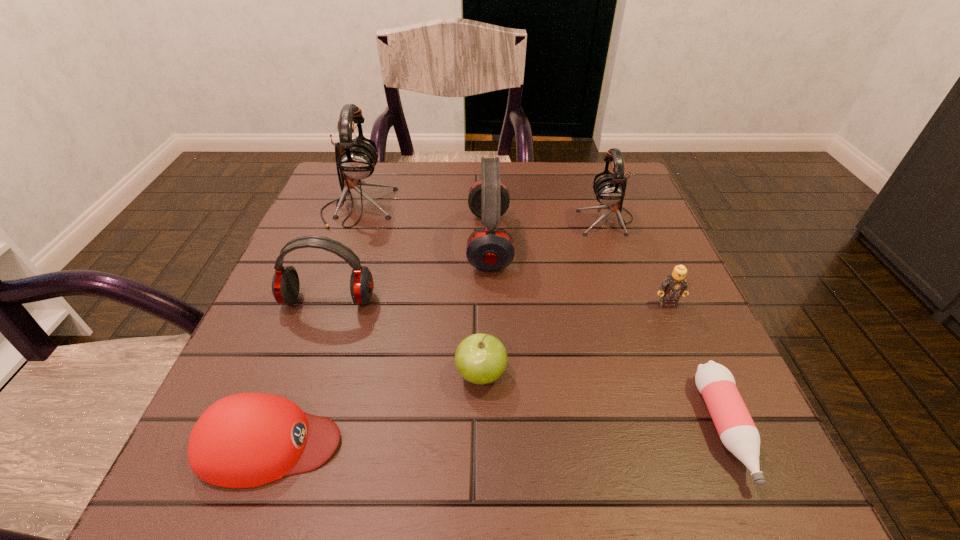
Identify the location of empty location between the tan Lego and the right black earphone. (636, 261).

Locate an element on the screen. free space between the Lego and the bottle is located at coordinates [x=696, y=366].

The width and height of the screenshot is (960, 540). Identify the location of free area in between the bigger black earphone and the green apple. pos(420,291).

The image size is (960, 540). I want to click on free spot between the pink bottle and the baseball cap, so click(x=497, y=436).

Where is `vacant area that lies between the bottle and the baseball cap`? vacant area that lies between the bottle and the baseball cap is located at coordinates (497, 436).

Locate an element on the screen. unoccupied position between the baseball cap and the bottle is located at coordinates (497, 436).

Where is `empty space between the pink bottle and the shortest earphone`? The width and height of the screenshot is (960, 540). empty space between the pink bottle and the shortest earphone is located at coordinates (527, 364).

You are a GUI agent. You are given a task and a screenshot of the screen. Output one action in this format:
    pyautogui.click(x=<x>, y=<y>)
    Task: Click on the empty space that is in between the pink bottle and the tallest earphone
    
    Given the screenshot: What is the action you would take?
    pyautogui.click(x=541, y=318)

Image resolution: width=960 pixels, height=540 pixels. Find the location of `unoccupied position between the right black earphone and the green apple`. unoccupied position between the right black earphone and the green apple is located at coordinates (543, 296).

Locate which object is the fourth closest to the right black earphone. Please provide its 2D coordinates. Your answer should be formatted as a tuple, i.e. [(x, y)], where the tuple contains the x and y coordinates of a point satisfying the conditions above.

[(480, 358)]